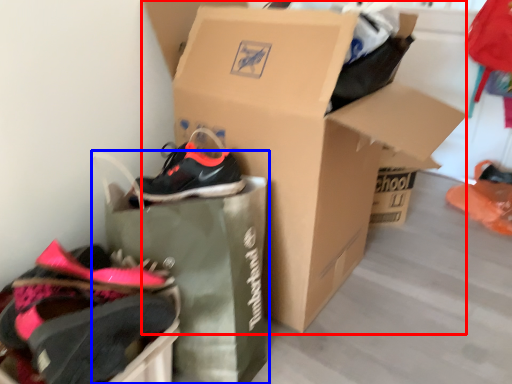
Question: Which object appears farthest to the camera in this image, box (highlighted by a red box) or shopping bag (highlighted by a blue box)?

Choices:
 (A) box
 (B) shopping bag

Answer: (A)